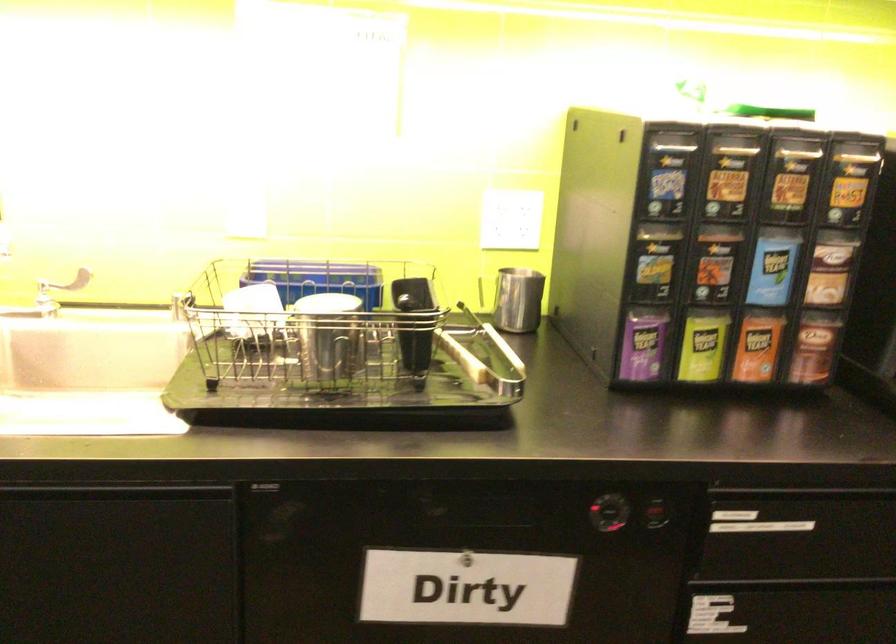
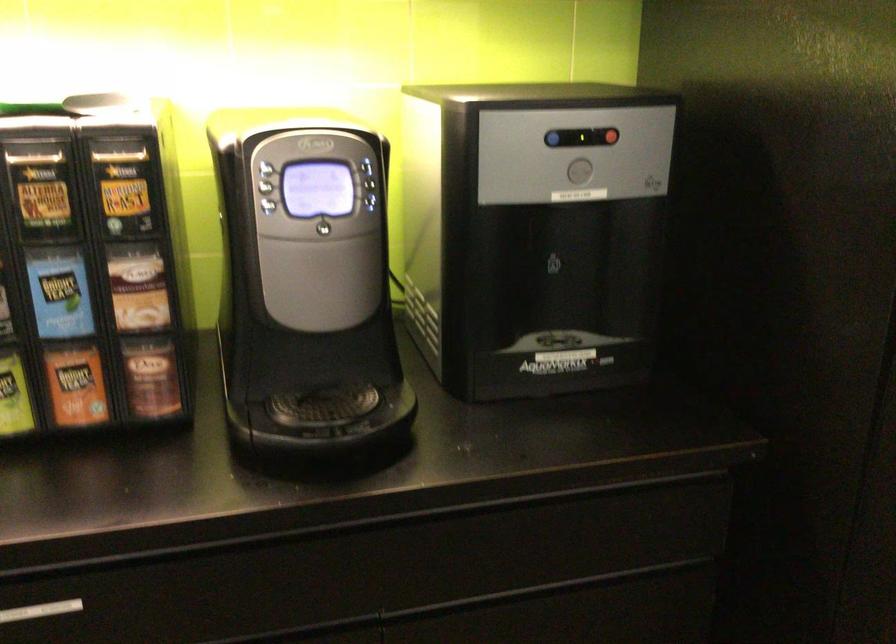
Locate, in the second image, the point that corresponds to point 789,181 in the first image.

(41, 191)